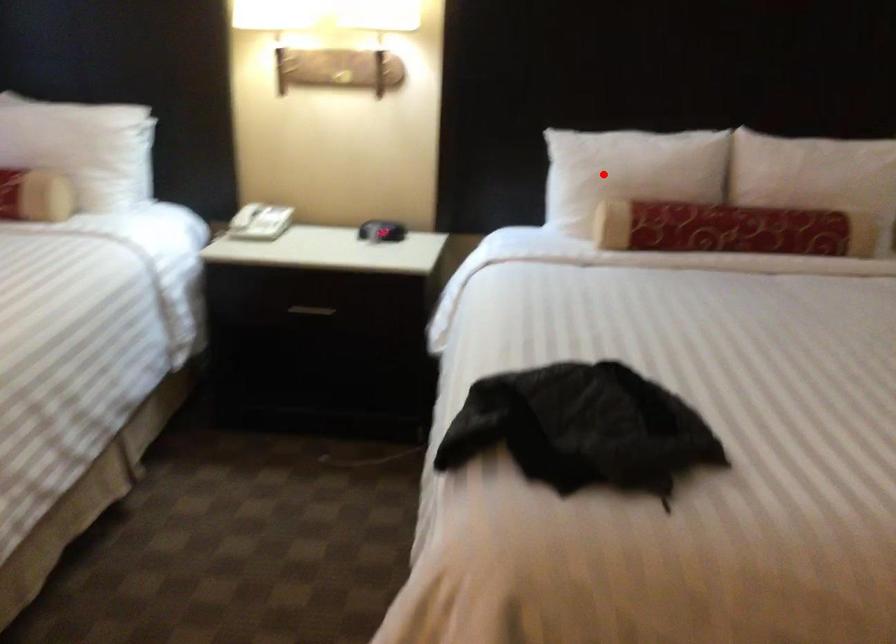
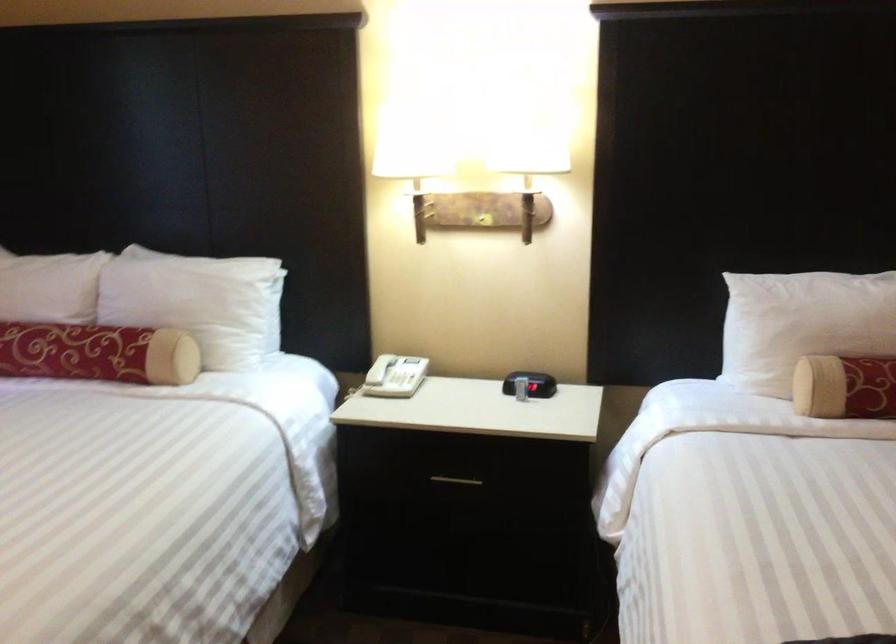
In the second image, find the point that corresponds to the highlighted location in the first image.

(802, 324)